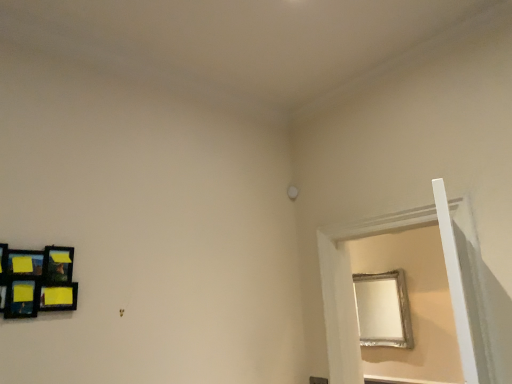
Locate an element on the screen. Image resolution: width=512 pixels, height=384 pixels. silver metallic frame at right is located at coordinates (351, 294).

What is the approximate width of silver metallic frame at right?

silver metallic frame at right is 7.91 inches wide.

Describe the element at coordinates (351, 294) in the screenshot. Image resolution: width=512 pixels, height=384 pixels. I see `silver metallic frame at right` at that location.

The height and width of the screenshot is (384, 512). What do you see at coordinates (38, 281) in the screenshot? I see `wooden-framed collage at left` at bounding box center [38, 281].

Find the location of `wooden-framed collage at left`. wooden-framed collage at left is located at coordinates (38, 281).

In the scene shown: Measure the distance between wooden-framed collage at left and camera.

They are 1.82 meters apart.

What is the approximate width of wooden-framed collage at left?

2.72 inches.

Find the location of a particular element. Image resolution: width=512 pixels, height=384 pixels. silver metallic frame at right is located at coordinates (351, 294).

Considering the positions of objects silver metallic frame at right and wooden-framed collage at left in the image provided, who is more to the right, silver metallic frame at right or wooden-framed collage at left?

silver metallic frame at right is more to the right.

Does silver metallic frame at right lie in front of wooden-framed collage at left?

No, silver metallic frame at right is behind wooden-framed collage at left.

Is point (459, 321) positioned after point (6, 269)?

No, it is not.

From the image's perspective, which is below, silver metallic frame at right or wooden-framed collage at left?

silver metallic frame at right is shown below in the image.

From a real-world perspective, between silver metallic frame at right and wooden-framed collage at left, who is vertically lower?

silver metallic frame at right, from a real-world perspective.

Based on the photo, which object is wider, silver metallic frame at right or wooden-framed collage at left?

silver metallic frame at right.

Between silver metallic frame at right and wooden-framed collage at left, which one has more height?

Standing taller between the two is silver metallic frame at right.

In terms of size, does silver metallic frame at right appear bigger or smaller than wooden-framed collage at left?

Considering their sizes, silver metallic frame at right takes up more space than wooden-framed collage at left.

Is silver metallic frame at right outside of wooden-framed collage at left?

That's correct, silver metallic frame at right is outside of wooden-framed collage at left.

Is silver metallic frame at right positioned far away from wooden-framed collage at left?

silver metallic frame at right is far away from wooden-framed collage at left.

Is silver metallic frame at right turned away from wooden-framed collage at left?

silver metallic frame at right is not turned away from wooden-framed collage at left.

You are a GUI agent. You are given a task and a screenshot of the screen. Output one action in this format:
    pyautogui.click(x=<x>, y=<y>)
    Task: Click on the picture frame above the silver metallic frame at right (from the image's perspective)
    The image size is (512, 384).
    Given the screenshot: What is the action you would take?
    pyautogui.click(x=38, y=281)

Can you confirm if wooden-framed collage at left is positioned to the right of silver metallic frame at right?

No, wooden-framed collage at left is not to the right of silver metallic frame at right.

Which object is further away from the camera taking this photo, wooden-framed collage at left or silver metallic frame at right?

silver metallic frame at right is further from the camera.

Is point (56, 310) less distant than point (353, 236)?

Yes, it is in front of point (353, 236).

From the image's perspective, relative to silver metallic frame at right, is wooden-framed collage at left above or below?

Clearly, from the image's perspective, wooden-framed collage at left is above silver metallic frame at right.

From a real-world perspective, is wooden-framed collage at left on top of silver metallic frame at right?

Yes, from a real-world perspective, wooden-framed collage at left is over silver metallic frame at right

Between wooden-framed collage at left and silver metallic frame at right, which one has smaller width?

wooden-framed collage at left.

Is wooden-framed collage at left taller than silver metallic frame at right?

No.

Considering the sizes of wooden-framed collage at left and silver metallic frame at right in the image, is wooden-framed collage at left bigger or smaller than silver metallic frame at right?

In the image, wooden-framed collage at left appears to be smaller than silver metallic frame at right.

Would you say wooden-framed collage at left contains silver metallic frame at right?

No, wooden-framed collage at left does not contain silver metallic frame at right.

Would you consider wooden-framed collage at left to be distant from silver metallic frame at right?

Yes.

Is wooden-framed collage at left positioned with its back to silver metallic frame at right?

No.

Locate an element on the screen. The width and height of the screenshot is (512, 384). window frame on the right of wooden-framed collage at left is located at coordinates (351, 294).

Find the location of a particular element. picture frame on the left side of silver metallic frame at right is located at coordinates (38, 281).

Where is `picture frame above the silver metallic frame at right (from the image's perspective)`? picture frame above the silver metallic frame at right (from the image's perspective) is located at coordinates (38, 281).